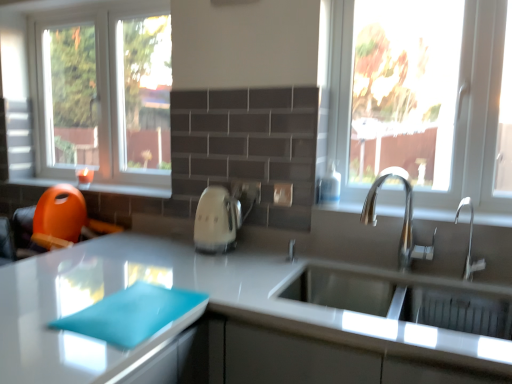
What is the approximate height of clear glass window at left, the second window in the front-to-back sequence?

The height of clear glass window at left, the second window in the front-to-back sequence, is 38.73 inches.

Image resolution: width=512 pixels, height=384 pixels. In order to click on orange plastic chair at left, the 2th window sill in the right-to-left sequence in this screenshot , I will do `click(97, 187)`.

Measure the distance between point (468,199) and camera.

The distance of point (468,199) from camera is 5.54 feet.

Describe the element at coordinates (131, 314) in the screenshot. I see `teal fabric placemat at center` at that location.

Locate an element on the screen. This screenshot has height=384, width=512. teal fabric placemat at center is located at coordinates (131, 314).

What do you see at coordinates (404, 218) in the screenshot? The height and width of the screenshot is (384, 512). I see `silver metallic faucet at center, placed as the first tap when sorted from left to right` at bounding box center [404, 218].

At what (x,y) coordinates should I click in order to perform the action: click on white glossy cutting board at lower left. Please return your answer as a coordinate pair (x, y). Looking at the image, I should click on (214, 312).

Is white glossy electric kettle at center at the left side of clear glass window at left, arranged as the 1th window when viewed from the back?

In fact, white glossy electric kettle at center is to the right of clear glass window at left, arranged as the 1th window when viewed from the back.

Is white glossy electric kettle at center positioned before clear glass window at left, arranged as the 1th window when viewed from the back?

Yes, the depth of white glossy electric kettle at center is less than that of clear glass window at left, arranged as the 1th window when viewed from the back.

Which point is more distant from viewer, (204,249) or (111,5)?

The point (111,5) is more distant.

Considering the sizes of objects white glossy electric kettle at center and clear glass window at left, the first window positioned from the left, in the image provided, who is smaller, white glossy electric kettle at center or clear glass window at left, the first window positioned from the left,?

Smaller between the two is white glossy electric kettle at center.

From a real-world perspective, who is located higher, orange plastic chair at left, the 2th window sill positioned from the front, or white glossy electric kettle at center?

orange plastic chair at left, the 2th window sill positioned from the front, from a real-world perspective.

Which is farther from the camera, (17, 183) or (203, 205)?

Point (17, 183)

Can you confirm if orange plastic chair at left, the 2th window sill positioned from the front, is positioned to the left of white glossy electric kettle at center?

Indeed, orange plastic chair at left, the 2th window sill positioned from the front, is positioned on the left side of white glossy electric kettle at center.

Considering the sizes of orange plastic chair at left, the 2th window sill positioned from the front, and white glossy electric kettle at center in the image, is orange plastic chair at left, the 2th window sill positioned from the front, taller or shorter than white glossy electric kettle at center?

Clearly, orange plastic chair at left, the 2th window sill positioned from the front, is shorter compared to white glossy electric kettle at center.

From the image's perspective, is metallic silver sink at right, marked as the 1th window sill in a bottom-to-top arrangement, located above or below clear glass window at left, arranged as the second window when viewed from the right?

Based on their image positions, metallic silver sink at right, marked as the 1th window sill in a bottom-to-top arrangement, is located beneath clear glass window at left, arranged as the second window when viewed from the right.

Considering the sizes of metallic silver sink at right, marked as the 1th window sill in a bottom-to-top arrangement, and clear glass window at left, the first window positioned from the left, in the image, is metallic silver sink at right, marked as the 1th window sill in a bottom-to-top arrangement, bigger or smaller than clear glass window at left, the first window positioned from the left,?

Clearly, metallic silver sink at right, marked as the 1th window sill in a bottom-to-top arrangement, is smaller in size than clear glass window at left, the first window positioned from the left.

Is metallic silver sink at right, arranged as the 2th window sill when viewed from the back, oriented away from clear glass window at left, the first window positioned from the left?

That's not correct — metallic silver sink at right, arranged as the 2th window sill when viewed from the back, is not looking away from clear glass window at left, the first window positioned from the left.

Is white glossy cutting board at lower left to the left or to the right of satin nickel faucet at sink right, positioned as the first tap in right-to-left order, in the image?

white glossy cutting board at lower left is positioned on satin nickel faucet at sink right, positioned as the first tap in right-to-left order,'s left side.

Starting from the white glossy cutting board at lower left, which tap is the 2nd one behind? Please provide its 2D coordinates.

[(469, 243)]

Are white glossy cutting board at lower left and satin nickel faucet at sink right, positioned as the second tap in left-to-right order, far apart?

They are positioned close to each other.

Is white glossy cutting board at lower left looking in the opposite direction of satin nickel faucet at sink right, positioned as the first tap in right-to-left order?

white glossy cutting board at lower left is not turned away from satin nickel faucet at sink right, positioned as the first tap in right-to-left order.

In the scene shown: Are satin nickel faucet at sink right, positioned as the first tap in right-to-left order, and white glossy electric kettle at center beside each other?

No, satin nickel faucet at sink right, positioned as the first tap in right-to-left order, is not beside white glossy electric kettle at center.

From the image's perspective, is satin nickel faucet at sink right, positioned as the first tap in right-to-left order, located above or below white glossy electric kettle at center?

Based on their image positions, satin nickel faucet at sink right, positioned as the first tap in right-to-left order, is located beneath white glossy electric kettle at center.

Which is closer, (474,269) or (197,210)?

The point (474,269) is closer.

Looking at this image, are clear glass window at left, the second window in the front-to-back sequence, and white glossy cutting board at lower left beside each other?

clear glass window at left, the second window in the front-to-back sequence, and white glossy cutting board at lower left are not in contact.

How far apart are clear glass window at left, arranged as the 1th window when viewed from the back, and white glossy cutting board at lower left?

3.31 feet.

Based on their positions, is clear glass window at left, arranged as the 1th window when viewed from the back, located to the left or right of white glossy cutting board at lower left?

In the image, clear glass window at left, arranged as the 1th window when viewed from the back, appears on the left side of white glossy cutting board at lower left.

At what (x,y) coordinates should I click in order to perform the action: click on the 2nd window directly above the white glossy cutting board at lower left (from a real-world perspective). Please return your answer as a coordinate pair (x, y). Looking at the image, I should click on (102, 93).

Does teal fabric placemat at center have a larger size compared to transparent glass window at upper right, the first window from the right?

No, teal fabric placemat at center is not bigger than transparent glass window at upper right, the first window from the right.

Are teal fabric placemat at center and transparent glass window at upper right, which is the 2th window in back-to-front order, beside each other?

teal fabric placemat at center and transparent glass window at upper right, which is the 2th window in back-to-front order, are clearly separated.

Considering the relative sizes of teal fabric placemat at center and transparent glass window at upper right, which is the 2th window in back-to-front order, in the image provided, is teal fabric placemat at center shorter than transparent glass window at upper right, which is the 2th window in back-to-front order,?

Correct, teal fabric placemat at center is not as tall as transparent glass window at upper right, which is the 2th window in back-to-front order.

What are the coordinates of `the 2nd window positioned above the white glossy electric kettle at center (from the image's perspective)` in the screenshot? It's located at (102, 93).

Locate an element on the screen. The width and height of the screenshot is (512, 384). appliance in front of the orange plastic chair at left, the first window sill viewed from the back is located at coordinates (216, 220).

Based on their spatial positions, is clear glass window at left, arranged as the 1th window when viewed from the back, or white glossy electric kettle at center further from satin nickel faucet at sink right, positioned as the first tap in right-to-left order?

clear glass window at left, arranged as the 1th window when viewed from the back, is further to satin nickel faucet at sink right, positioned as the first tap in right-to-left order.

When comparing their distances from metallic silver sink at right, arranged as the first window sill when viewed from the right, does clear glass window at left, arranged as the second window when viewed from the right, or satin nickel faucet at sink right, positioned as the second tap in left-to-right order, seem closer?

satin nickel faucet at sink right, positioned as the second tap in left-to-right order, lies closer to metallic silver sink at right, arranged as the first window sill when viewed from the right, than the other object.

From the picture: From the image, which object appears to be nearer to satin nickel faucet at sink right, positioned as the first tap in right-to-left order, metallic silver sink at right, arranged as the 1th window sill when viewed from the front, or teal fabric placemat at center?

metallic silver sink at right, arranged as the 1th window sill when viewed from the front.

Estimate the real-world distances between objects in this image. Which object is further from white glossy cutting board at lower left, clear glass window at left, arranged as the second window when viewed from the right, or transparent glass window at upper right, arranged as the 2th window when viewed from the left?

The object further to white glossy cutting board at lower left is clear glass window at left, arranged as the second window when viewed from the right.

Considering their positions, is transparent glass window at upper right, which is the 2th window in back-to-front order, positioned closer to white glossy electric kettle at center than white glossy cutting board at lower left?

Based on the image, white glossy cutting board at lower left appears to be nearer to white glossy electric kettle at center.

When comparing their distances from white glossy cutting board at lower left, does orange plastic chair at left, the first window sill from the top, or clear glass window at left, arranged as the 1th window when viewed from the back, seem further?

clear glass window at left, arranged as the 1th window when viewed from the back, lies further to white glossy cutting board at lower left than the other object.

From the image, which object appears to be nearer to clear glass window at left, arranged as the 1th window when viewed from the back, satin nickel faucet at sink right, positioned as the first tap in right-to-left order, or transparent glass window at upper right, which is the first window from front to back?

The object closer to clear glass window at left, arranged as the 1th window when viewed from the back, is transparent glass window at upper right, which is the first window from front to back.

Which object lies nearer to the anchor point clear glass window at left, arranged as the second window when viewed from the right, metallic silver sink at right, arranged as the 1th window sill when viewed from the front, or white glossy cutting board at lower left?

white glossy cutting board at lower left is positioned closer to the anchor clear glass window at left, arranged as the second window when viewed from the right.

Image resolution: width=512 pixels, height=384 pixels. What are the coordinates of `window sill located between clear glass window at left, arranged as the 1th window when viewed from the back, and transparent glass window at upper right, which is the first window from front to back, in the left-right direction` in the screenshot? It's located at (434, 214).

This screenshot has height=384, width=512. In order to click on tap between transparent glass window at upper right, arranged as the 2th window when viewed from the left, and satin nickel faucet at sink right, positioned as the second tap in left-to-right order, in the up-down direction in this screenshot , I will do `click(404, 218)`.

Find the location of a particular element. This screenshot has height=384, width=512. place mat between clear glass window at left, the first window positioned from the left, and metallic silver sink at right, arranged as the first window sill when viewed from the right, from left to right is located at coordinates (131, 314).

Identify the location of appliance between white glossy cutting board at lower left and transparent glass window at upper right, arranged as the 2th window when viewed from the left, in the horizontal direction. The image size is (512, 384). (216, 220).